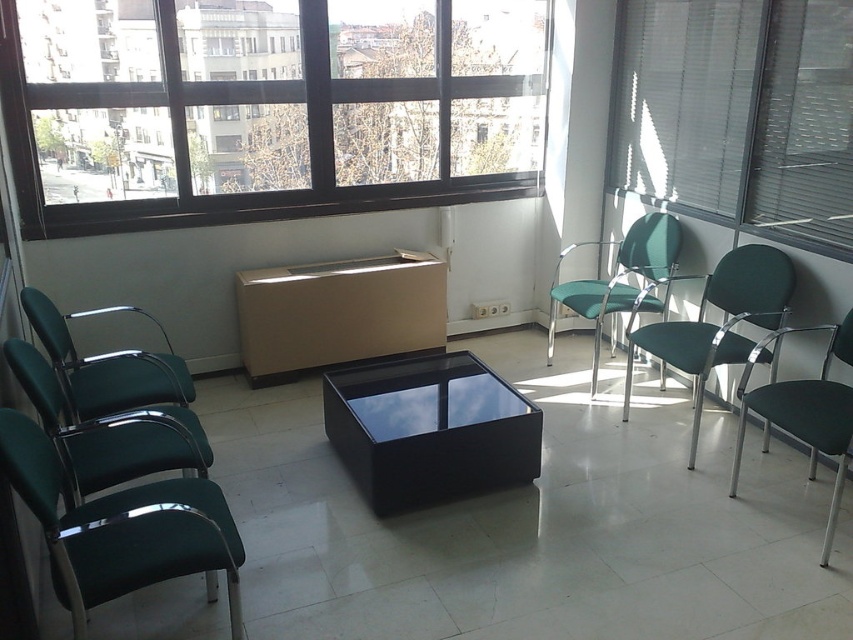
Consider the image. Does transparent glass window at upper center appear under matte cardboard box at center?

No.

Locate an element on the screen. The image size is (853, 640). transparent glass window at upper center is located at coordinates (267, 108).

Find the location of `transparent glass window at upper center`. transparent glass window at upper center is located at coordinates (267, 108).

Who is shorter, white blinds at upper right or green plastic chair at left?

green plastic chair at left is shorter.

Can you confirm if white blinds at upper right is thinner than green plastic chair at left?

No, white blinds at upper right is not thinner than green plastic chair at left.

Between point (676, 58) and point (122, 522), which one is positioned in front?

Point (122, 522)

At what (x,y) coordinates should I click in order to perform the action: click on white blinds at upper right. Please return your answer as a coordinate pair (x, y). The width and height of the screenshot is (853, 640). Looking at the image, I should click on (738, 112).

Is matte cardboard box at center bigger than green leather chair at left?

Correct, matte cardboard box at center is larger in size than green leather chair at left.

This screenshot has height=640, width=853. What do you see at coordinates (338, 312) in the screenshot?
I see `matte cardboard box at center` at bounding box center [338, 312].

I want to click on matte cardboard box at center, so click(x=338, y=312).